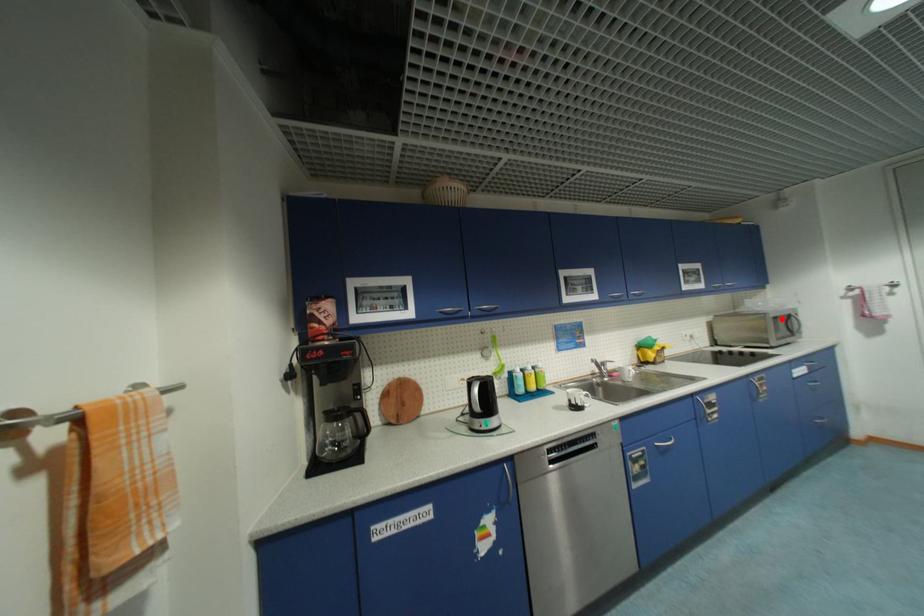
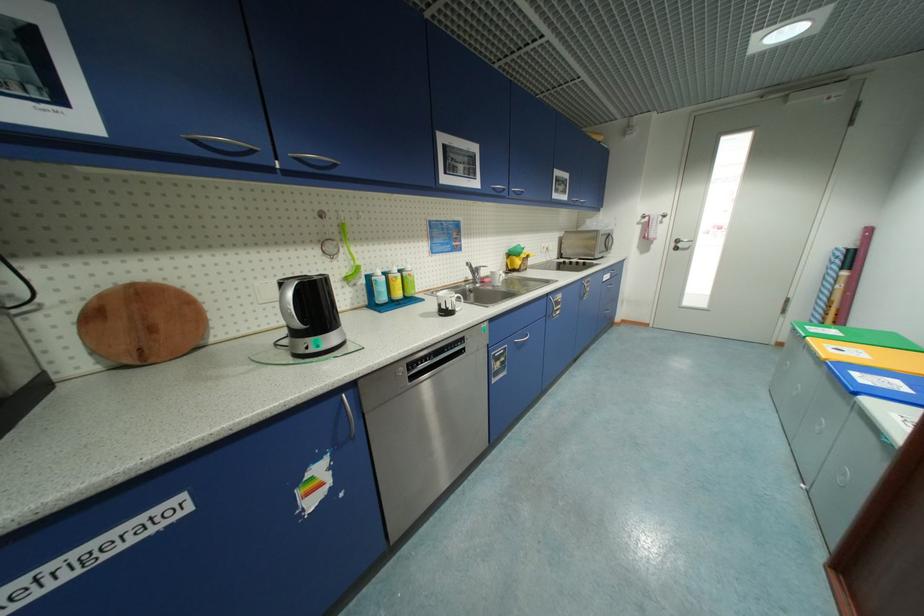
Find the pixel in the second image that matches the highlighted location in the first image.

(609, 236)